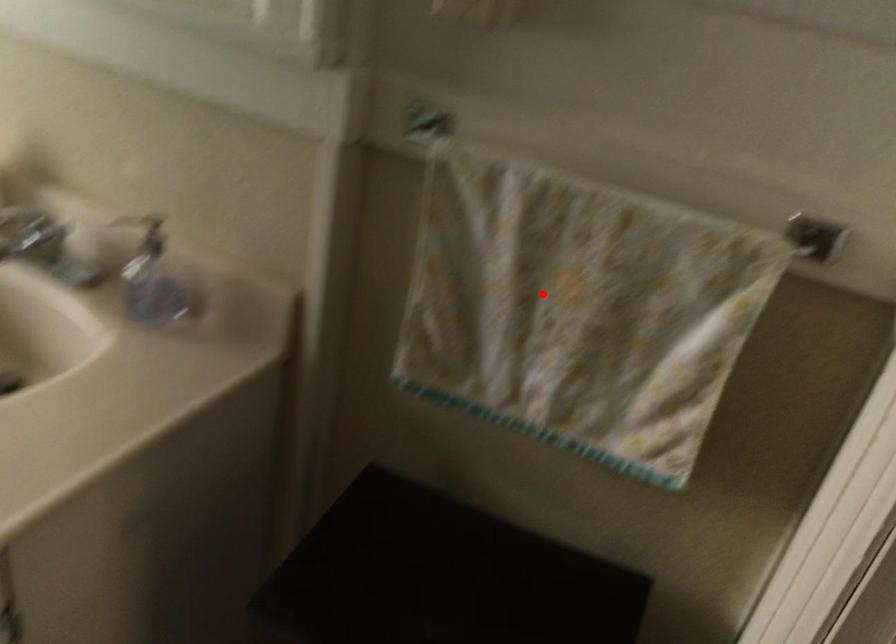
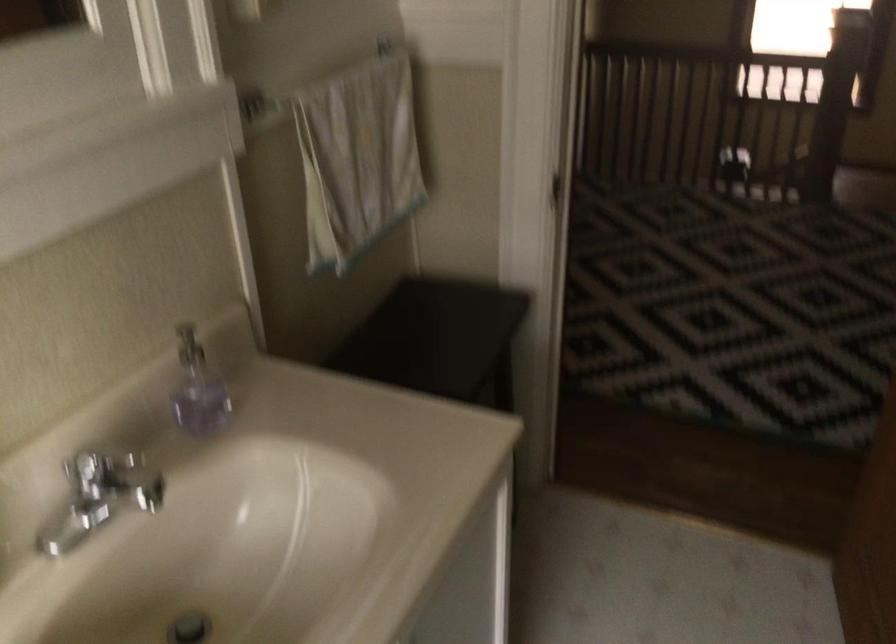
Question: I am providing you with two images of the same scene from different viewpoints. Given a red point in image1, look at the same physical point in image2. Is it:

Choices:
 (A) Closer to the viewpoint
 (B) Farther from the viewpoint

Answer: (B)